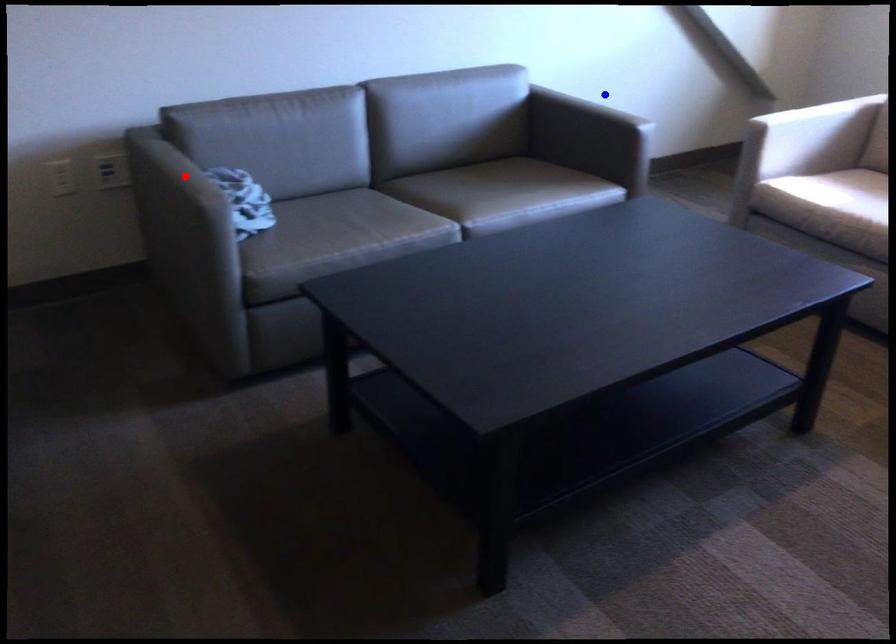
Question: In the image, two points are highlighted. Which point is nearer to the camera? Reply with the corresponding letter.

Choices:
 (A) blue point
 (B) red point

Answer: (B)